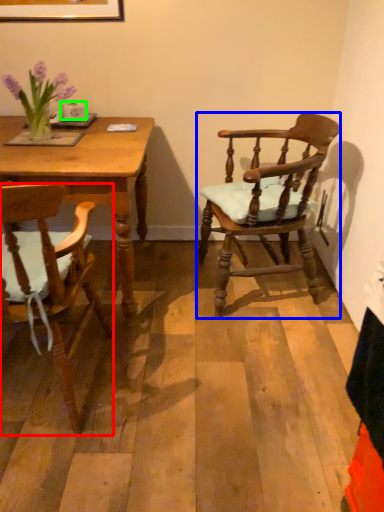
Question: Estimate the real-world distances between objects in this image. Which object is farther from chair (highlighted by a red box), chair (highlighted by a blue box) or coffee cup (highlighted by a green box)?

Choices:
 (A) chair
 (B) coffee cup

Answer: (B)